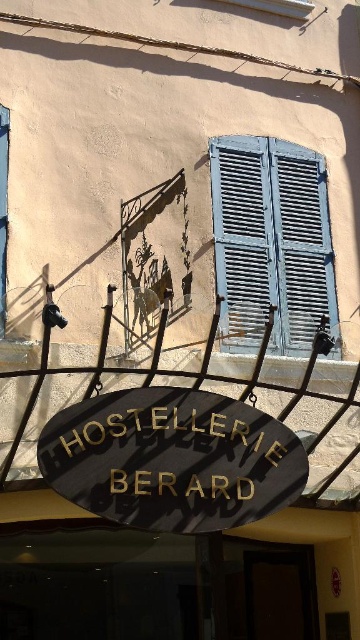
Is goldmaterial/texturehostellerie berard sign at center bigger than blue painted wood shutters at upper right?

Actually, goldmaterial/texturehostellerie berard sign at center might be smaller than blue painted wood shutters at upper right.

Does goldmaterial/texturehostellerie berard sign at center appear under blue painted wood shutters at upper right?

Indeed, goldmaterial/texturehostellerie berard sign at center is positioned under blue painted wood shutters at upper right.

Measure the distance between point (209, 436) and camera.

Point (209, 436) is 8.64 meters from camera.

This screenshot has width=360, height=640. I want to click on goldmaterial/texturehostellerie berard sign at center, so click(171, 449).